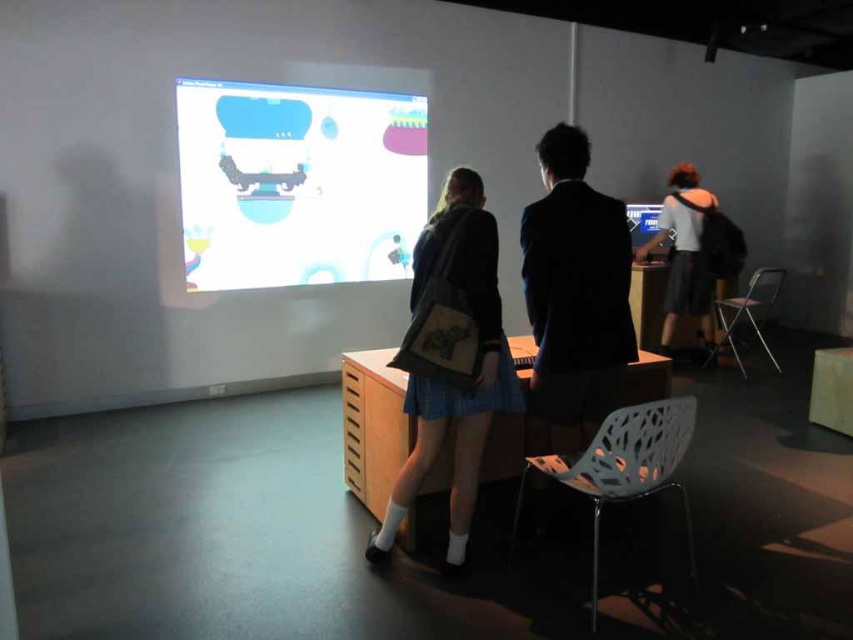
You are standing in the room and want to locate the white glossy projection screen at upper center. According to the coordinates provided, where should you look?

The white glossy projection screen at upper center is located at point (297, 182).

You are a visitor in the room and want to take a photo of the white glossy projection screen at upper center without including the gray fabric shirt at center right in the frame. Given their sizes, is this possible?

The white glossy projection screen at upper center is larger than the gray fabric shirt at center right, so it is possible to take a photo of the white glossy projection screen at upper center without including the gray fabric shirt at center right by framing the shot to focus on the larger screen while excluding the smaller shirt.